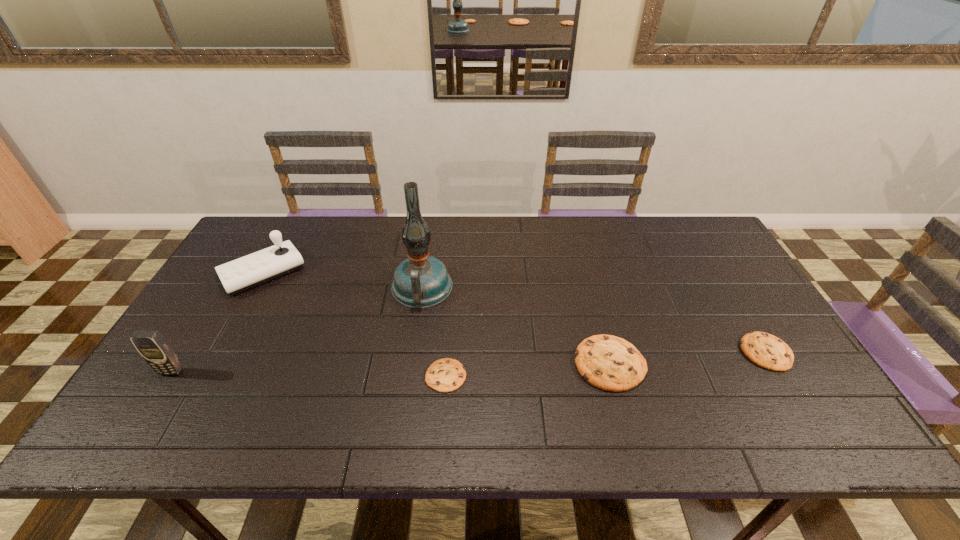
Given the evenly spaced cookies in the image, where should an extra cookie be added on the left to preserve the spacing? Please point to a vacant space. Please provide its 2D coordinates. Your answer should be formatted as a tuple, i.e. [(x, y)], where the tuple contains the x and y coordinates of a point satisfying the conditions above.

[(274, 389)]